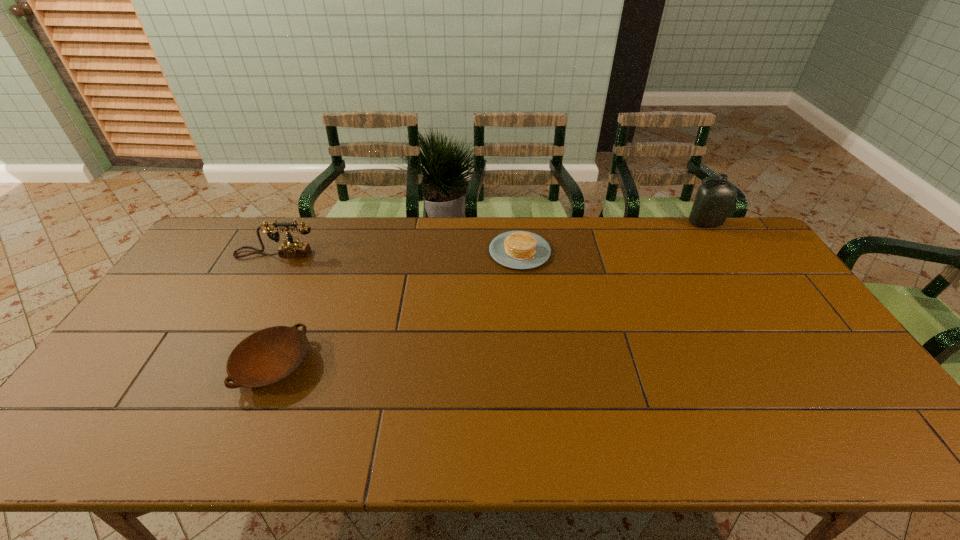
Where is `free space that is in between the second tallest object and the nearest object`? free space that is in between the second tallest object and the nearest object is located at coordinates (275, 309).

This screenshot has height=540, width=960. Find the location of `vacant area that lies between the third shortest object and the pancake`. vacant area that lies between the third shortest object and the pancake is located at coordinates (397, 253).

The height and width of the screenshot is (540, 960). Find the location of `vacant area between the plate and the farthest object`. vacant area between the plate and the farthest object is located at coordinates (489, 294).

This screenshot has width=960, height=540. I want to click on vacant area that lies between the telephone and the nearest object, so click(275, 309).

You are a GUI agent. You are given a task and a screenshot of the screen. Output one action in this format:
    pyautogui.click(x=<x>, y=<y>)
    Task: Click on the free space between the telephone and the pancake
    Image resolution: width=960 pixels, height=540 pixels.
    Given the screenshot: What is the action you would take?
    pyautogui.click(x=397, y=253)

At what (x,y) coordinates should I click in order to perform the action: click on free spot between the telephone and the plate. Please return your answer as a coordinate pair (x, y). This screenshot has height=540, width=960. Looking at the image, I should click on (275, 309).

Locate an element on the screen. Image resolution: width=960 pixels, height=540 pixels. empty space that is in between the plate and the tallest object is located at coordinates (489, 294).

At what (x,y) coordinates should I click in order to perform the action: click on free space between the plate and the second object from right to left. Please return your answer as a coordinate pair (x, y). The image size is (960, 540). Looking at the image, I should click on (396, 308).

You are a GUI agent. You are given a task and a screenshot of the screen. Output one action in this format:
    pyautogui.click(x=<x>, y=<y>)
    Task: Click on the free point between the third object from left to right and the bottle
    This screenshot has width=960, height=540.
    Given the screenshot: What is the action you would take?
    pyautogui.click(x=612, y=238)

Where is `object that is the second closest to the nearest object`? This screenshot has height=540, width=960. object that is the second closest to the nearest object is located at coordinates (515, 249).